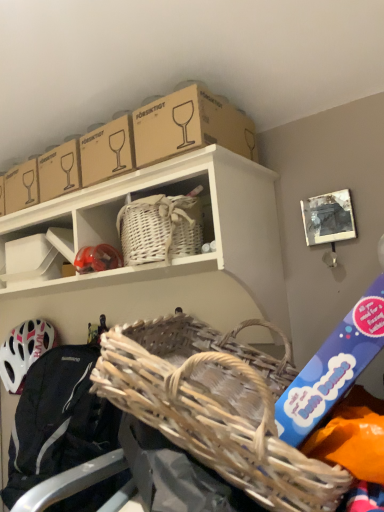
Question: Looking at their shapes, would you say brown cardboard box at upper center is wider or thinner than woven natural picnic basket at center?

Choices:
 (A) wide
 (B) thin

Answer: (B)

Question: Relative to woven natural picnic basket at center, is brown cardboard box at upper center in front or behind?

Choices:
 (A) front
 (B) behind

Answer: (B)

Question: Which is nearer to the white matte helmet at lower left?

Choices:
 (A) white plastic tray at lower left
 (B) matte red helmet at center
 (C) woven fabric basket at lower left
 (D) brown cardboard box at upper center
 (E) white wicker basket at upper center

Answer: (C)

Question: Which of these objects is positioned farthest from the woven natural picnic basket at center?

Choices:
 (A) white plastic tray at lower left
 (B) matte red helmet at center
 (C) woven fabric basket at lower left
 (D) white matte helmet at lower left
 (E) brown cardboard box at upper center

Answer: (D)